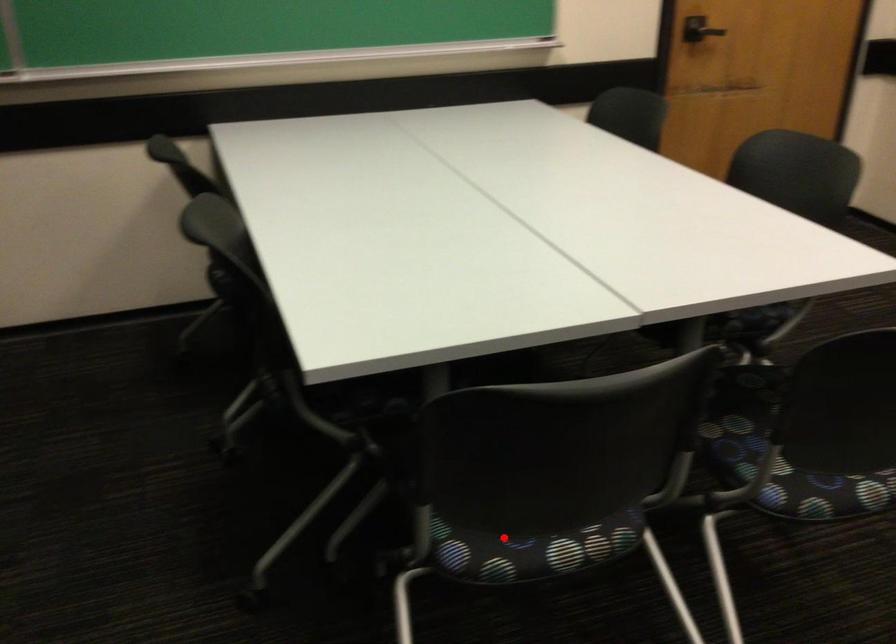
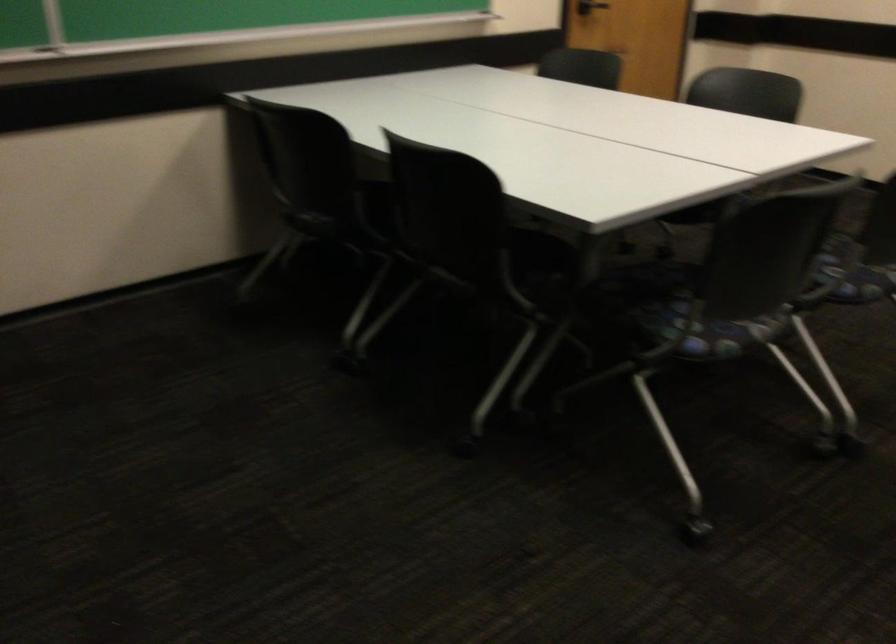
In the second image, find the point that corresponds to the highlighted location in the first image.

(719, 333)